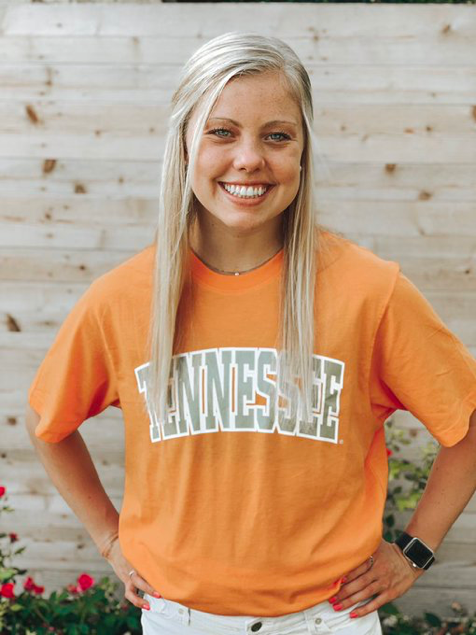
At what (x,y) coordinates should I click in order to perform the action: click on wall. Please return your answer as a coordinate pair (x, y). Looking at the image, I should click on (442, 173), (379, 128), (68, 159).